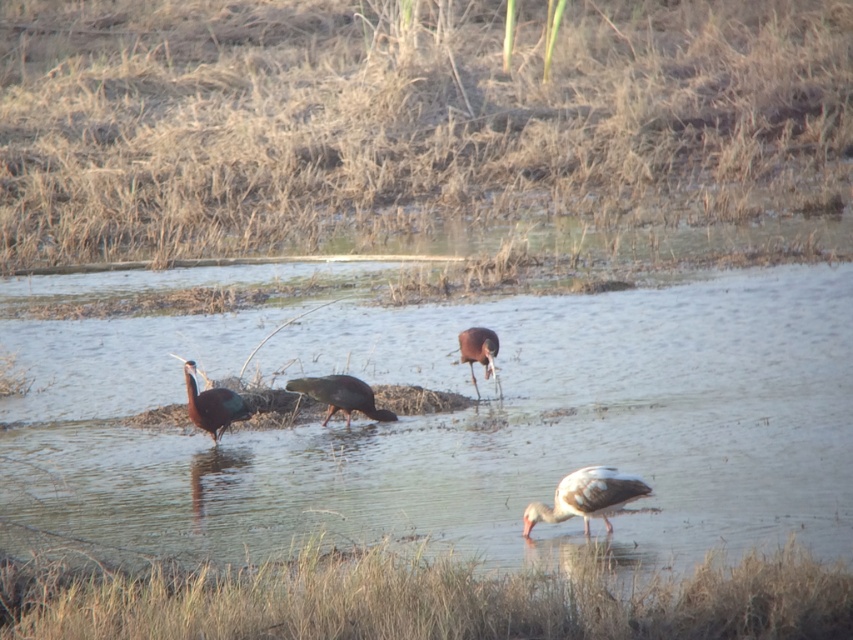
Question: Which object is closer to the camera taking this photo?

Choices:
 (A) shiny metallic bird at center
 (B) brown grass at upper center
 (C) white matte bird at lower right
 (D) shiny dark green bird at center

Answer: (C)

Question: Is brown grass at upper center wider than clear water at center?

Choices:
 (A) no
 (B) yes

Answer: (B)

Question: Is the position of brown grass at upper center more distant than that of shiny brown bird at center?

Choices:
 (A) yes
 (B) no

Answer: (A)

Question: Is clear water at center bigger than shiny brown bird at center?

Choices:
 (A) no
 (B) yes

Answer: (B)

Question: Which object appears closest to the camera in this image?

Choices:
 (A) shiny dark green bird at center
 (B) brown grass at upper center
 (C) white matte bird at lower right

Answer: (C)

Question: Which point is closer to the camera taking this photo?

Choices:
 (A) (212, 426)
 (B) (650, 492)
 (C) (477, 388)

Answer: (B)